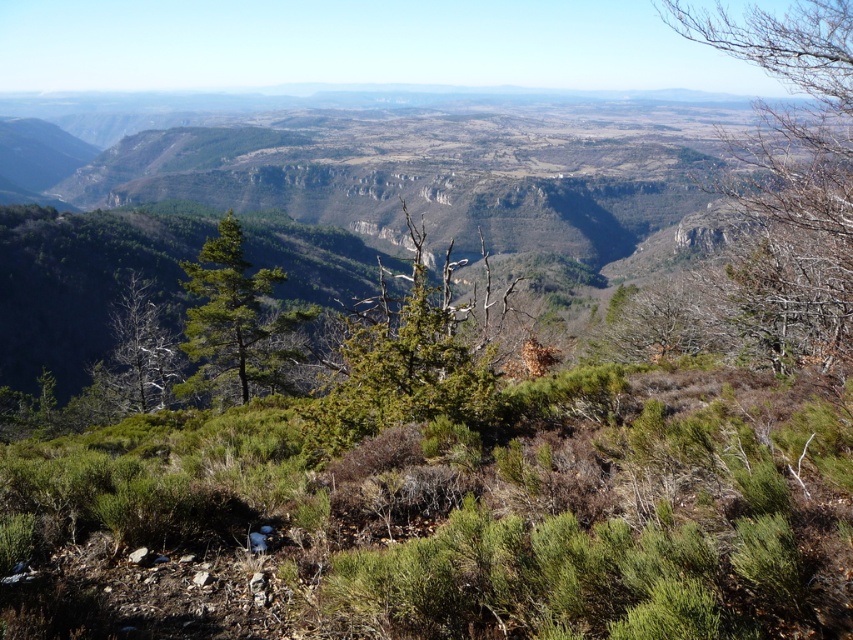
Question: Can you confirm if bare branches at upper right is positioned to the left of green leafy tree at center?

Choices:
 (A) yes
 (B) no

Answer: (B)

Question: Does green leafy tree at center appear on the left side of green matte tree at center?

Choices:
 (A) no
 (B) yes

Answer: (A)

Question: Which point is closer to the camera?

Choices:
 (A) (113, 397)
 (B) (805, 284)
 (C) (485, 387)
 (D) (281, 342)

Answer: (C)

Question: Which point is closer to the camera?

Choices:
 (A) dead wood at left
 (B) bare branches at upper right
 (C) green matte tree at center

Answer: (B)

Question: Which point is farther from the camera taking this photo?

Choices:
 (A) (352, 342)
 (B) (223, 259)
 (C) (123, 387)

Answer: (C)

Question: Can you confirm if green matte tree at center is positioned to the left of dead wood at left?

Choices:
 (A) no
 (B) yes

Answer: (A)